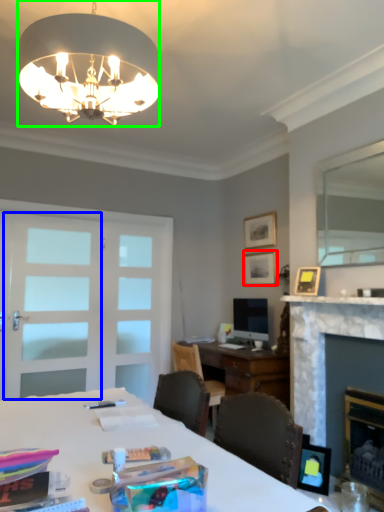
Question: Based on their relative distances, which object is farther from picture frame (highlighted by a red box)? Choose from screen door (highlighted by a blue box) and lamp (highlighted by a green box).

Choices:
 (A) screen door
 (B) lamp

Answer: (B)